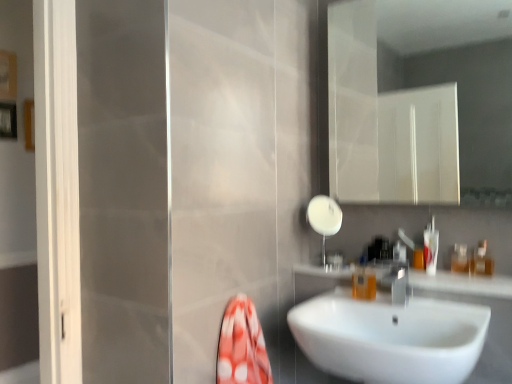
Where is `vacant space to the right of silver metallic tap at sink right`? The width and height of the screenshot is (512, 384). vacant space to the right of silver metallic tap at sink right is located at coordinates (445, 307).